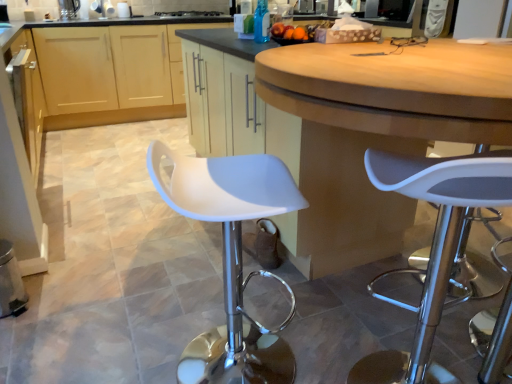
Question: From the image's perspective, would you say matte wood cabinets at center, the 1th cabinetry from the back, is shown under blue glass bottle at upper center?

Choices:
 (A) no
 (B) yes

Answer: (A)

Question: Does matte wood cabinets at center, the 1th cabinetry from the back, have a greater height compared to blue glass bottle at upper center?

Choices:
 (A) yes
 (B) no

Answer: (A)

Question: Is matte wood cabinets at center, the 1th cabinetry from the back, next to blue glass bottle at upper center and touching it?

Choices:
 (A) no
 (B) yes

Answer: (A)

Question: Can you confirm if matte wood cabinets at center, the 1th cabinetry from the back, is positioned to the left of blue glass bottle at upper center?

Choices:
 (A) yes
 (B) no

Answer: (A)

Question: Is matte wood cabinets at center, the 1th cabinetry from the back, outside of blue glass bottle at upper center?

Choices:
 (A) no
 (B) yes

Answer: (B)

Question: From a real-world perspective, is matte wood cabinets at center, the second cabinetry in the front-to-back sequence, below blue glass bottle at upper center?

Choices:
 (A) no
 (B) yes

Answer: (B)

Question: Is the depth of white plastic stool at center greater than that of black glass stove at upper center?

Choices:
 (A) yes
 (B) no

Answer: (B)

Question: Is white plastic stool at center at the left side of black glass stove at upper center?

Choices:
 (A) yes
 (B) no

Answer: (B)

Question: Does white plastic stool at center have a lesser height compared to black glass stove at upper center?

Choices:
 (A) yes
 (B) no

Answer: (B)

Question: From the image's perspective, does white plastic stool at center appear lower than black glass stove at upper center?

Choices:
 (A) no
 (B) yes

Answer: (B)

Question: Is white plastic stool at center bigger than black glass stove at upper center?

Choices:
 (A) yes
 (B) no

Answer: (A)

Question: Is black glass stove at upper center a part of white plastic stool at center?

Choices:
 (A) no
 (B) yes

Answer: (A)

Question: Is white plastic stool at center positioned behind blue glass bottle at upper center?

Choices:
 (A) yes
 (B) no

Answer: (B)